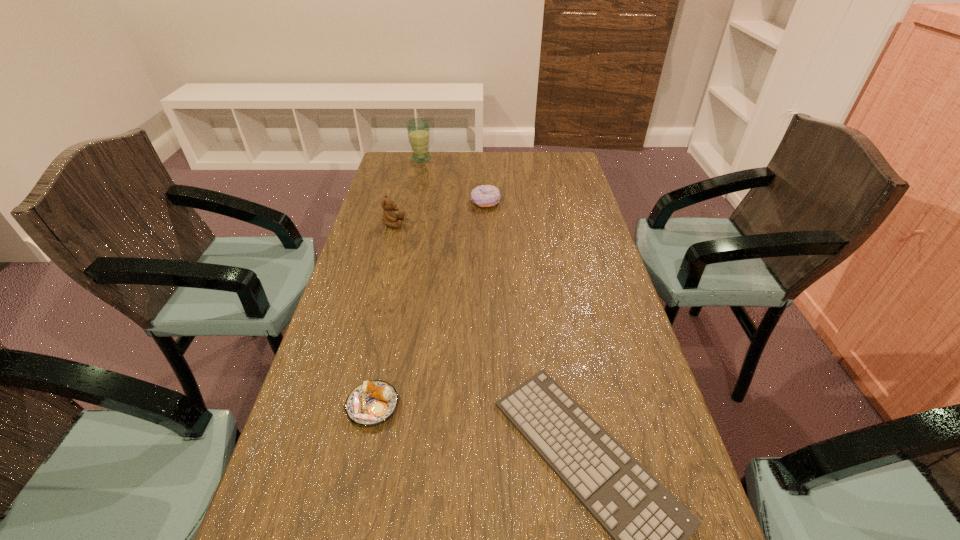
I want to click on object identified as the second closest to the shortest object, so tap(389, 217).

I want to click on vacant region that satisfies the following two spatial constraints: 1. on the front side of the tallest object; 2. on the front-facing side of the third nearest object, so click(x=407, y=224).

Where is `vacant space that satisfies the following two spatial constraints: 1. on the front side of the fourth nearest object; 2. on the front-facing side of the teddy bear`? This screenshot has width=960, height=540. vacant space that satisfies the following two spatial constraints: 1. on the front side of the fourth nearest object; 2. on the front-facing side of the teddy bear is located at coordinates (486, 224).

The image size is (960, 540). Find the location of `vacant space that satisfies the following two spatial constraints: 1. on the front-facing side of the teddy bear; 2. on the back side of the pastry`. vacant space that satisfies the following two spatial constraints: 1. on the front-facing side of the teddy bear; 2. on the back side of the pastry is located at coordinates (345, 406).